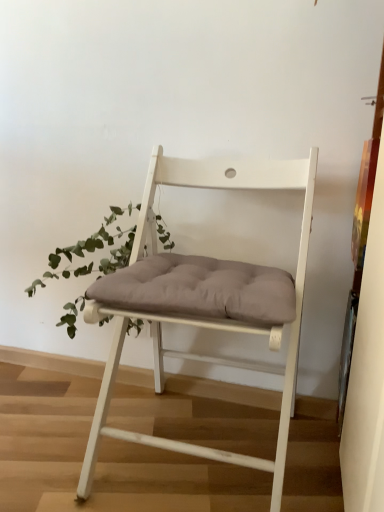
The width and height of the screenshot is (384, 512). What do you see at coordinates (207, 315) in the screenshot?
I see `white wood chair at center` at bounding box center [207, 315].

This screenshot has height=512, width=384. What are the coordinates of `white wood chair at center` in the screenshot? It's located at (207, 315).

Image resolution: width=384 pixels, height=512 pixels. In order to click on green leafy plant at left in this screenshot , I will do `click(92, 251)`.

The height and width of the screenshot is (512, 384). What do you see at coordinates (92, 251) in the screenshot?
I see `green leafy plant at left` at bounding box center [92, 251].

Where is `white wood chair at center`? This screenshot has height=512, width=384. white wood chair at center is located at coordinates (207, 315).

Considering the positions of objects green leafy plant at left and white wood chair at center in the image provided, who is more to the left, green leafy plant at left or white wood chair at center?

green leafy plant at left is more to the left.

In the scene shown: Which object is further away from the camera taking this photo, green leafy plant at left or white wood chair at center?

green leafy plant at left is behind.

Is point (125, 255) farther from viewer compared to point (141, 278)?

Yes, it is.

From the image's perspective, does green leafy plant at left appear higher than white wood chair at center?

Yes, from the image's perspective, green leafy plant at left is above white wood chair at center.

In the scene shown: From a real-world perspective, is green leafy plant at left above or below white wood chair at center?

green leafy plant at left is below white wood chair at center.

Considering the sizes of green leafy plant at left and white wood chair at center in the image, is green leafy plant at left wider or thinner than white wood chair at center?

Clearly, green leafy plant at left has less width compared to white wood chair at center.

Can you confirm if green leafy plant at left is taller than white wood chair at center?

No, green leafy plant at left is not taller than white wood chair at center.

Based on their sizes in the image, would you say green leafy plant at left is bigger or smaller than white wood chair at center?

Considering their sizes, green leafy plant at left takes up less space than white wood chair at center.

Would you say white wood chair at center is part of green leafy plant at left's contents?

Definitely not — white wood chair at center is not inside green leafy plant at left.

Is green leafy plant at left far away from white wood chair at center?

No, green leafy plant at left is in close proximity to white wood chair at center.

Does green leafy plant at left turn towards white wood chair at center?

No, green leafy plant at left does not turn towards white wood chair at center.

Find the location of a particular element. This screenshot has width=384, height=512. houseplant lying on the left of white wood chair at center is located at coordinates (92, 251).

Between white wood chair at center and green leafy plant at left, which one appears on the left side from the viewer's perspective?

Positioned to the left is green leafy plant at left.

Is white wood chair at center in front of green leafy plant at left?

Yes, it is in front of green leafy plant at left.

Which is behind, point (228, 311) or point (103, 232)?

The point (103, 232) is more distant.

From the image's perspective, is white wood chair at center on top of green leafy plant at left?

No, from the image's perspective, white wood chair at center is not over green leafy plant at left.

From a real-world perspective, is white wood chair at center on top of green leafy plant at left?

Yes, from a real-world perspective, white wood chair at center is above green leafy plant at left.

Between white wood chair at center and green leafy plant at left, which one has larger width?

white wood chair at center.

Between white wood chair at center and green leafy plant at left, which one has less height?

With less height is green leafy plant at left.

Considering the sizes of objects white wood chair at center and green leafy plant at left in the image provided, who is bigger, white wood chair at center or green leafy plant at left?

With larger size is white wood chair at center.

Is white wood chair at center outside of green leafy plant at left?

Yes, white wood chair at center is outside of green leafy plant at left.

Is there a large distance between white wood chair at center and green leafy plant at left?

No, white wood chair at center is in close proximity to green leafy plant at left.

Is white wood chair at center looking in the opposite direction of green leafy plant at left?

No, white wood chair at center is not facing away from green leafy plant at left.

How much distance is there between white wood chair at center and green leafy plant at left?

They are 9.89 inches apart.

Locate an element on the screen. The height and width of the screenshot is (512, 384). houseplant behind the white wood chair at center is located at coordinates (92, 251).

Locate an element on the screen. This screenshot has width=384, height=512. chair that appears above the green leafy plant at left (from a real-world perspective) is located at coordinates (207, 315).

This screenshot has width=384, height=512. Identify the location of houseplant behind the white wood chair at center. (92, 251).